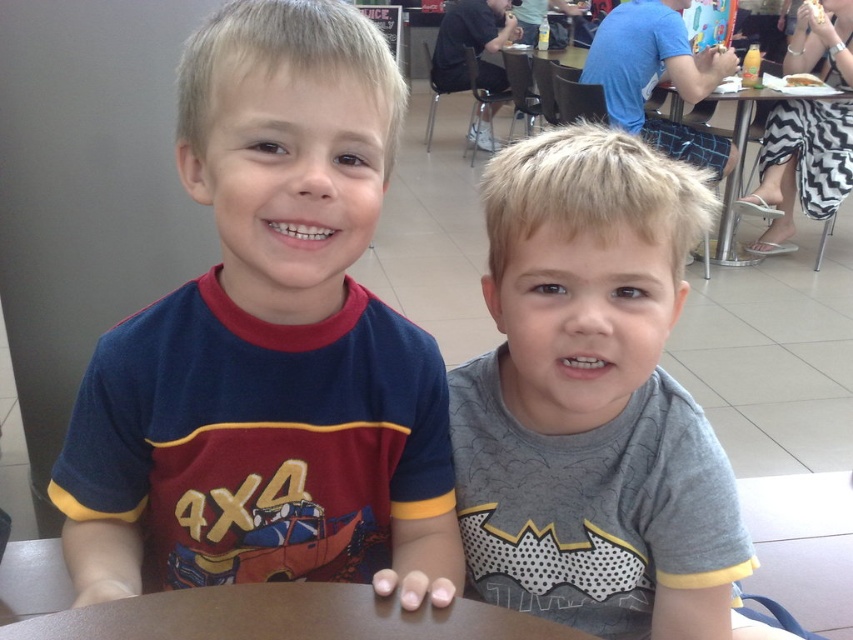
Question: Which point appears farthest from the camera in this image?

Choices:
 (A) (737, 248)
 (B) (706, 538)

Answer: (A)

Question: Is gray cotton shirt at center positioned behind metallic silver table at center?

Choices:
 (A) yes
 (B) no

Answer: (B)

Question: Can you confirm if maroon fabric shirt at center is wider than black and white zigzag dress at right?

Choices:
 (A) yes
 (B) no

Answer: (B)

Question: Among these objects, which one is nearest to the camera?

Choices:
 (A) metallic silver table at center
 (B) black and white zigzag dress at right
 (C) gray cotton shirt at center

Answer: (C)

Question: Based on their relative distances, which object is nearer to the black and white zigzag dress at right?

Choices:
 (A) gray cotton shirt at center
 (B) metallic silver table at center

Answer: (B)

Question: Is maroon fabric shirt at center to the left of black and white zigzag dress at right from the viewer's perspective?

Choices:
 (A) no
 (B) yes

Answer: (B)